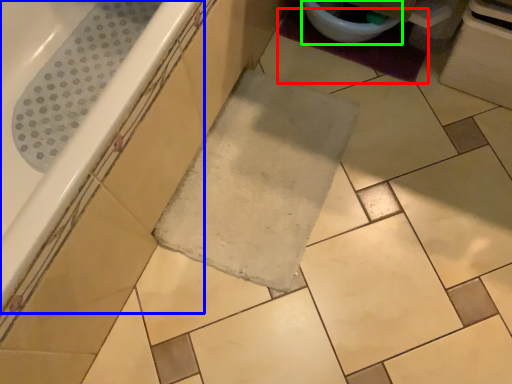
Question: Which is nearer to the bath mat (highlighted by a red box)? bathtub (highlighted by a blue box) or toilet bowl (highlighted by a green box).

Choices:
 (A) bathtub
 (B) toilet bowl

Answer: (B)